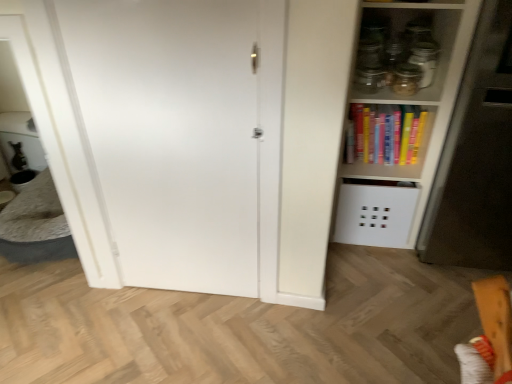
The width and height of the screenshot is (512, 384). In order to click on free location in front of white matte door at center in this screenshot , I will do `click(187, 337)`.